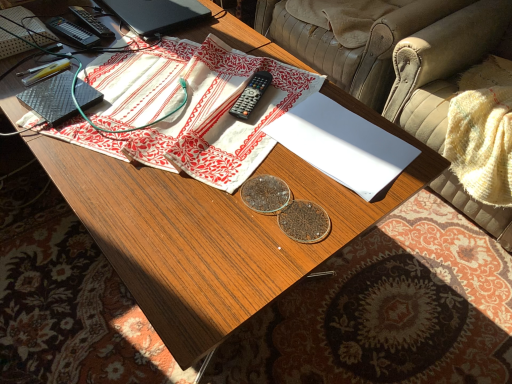
Find the location of a particular element. free space to the left of white paper at center is located at coordinates (230, 134).